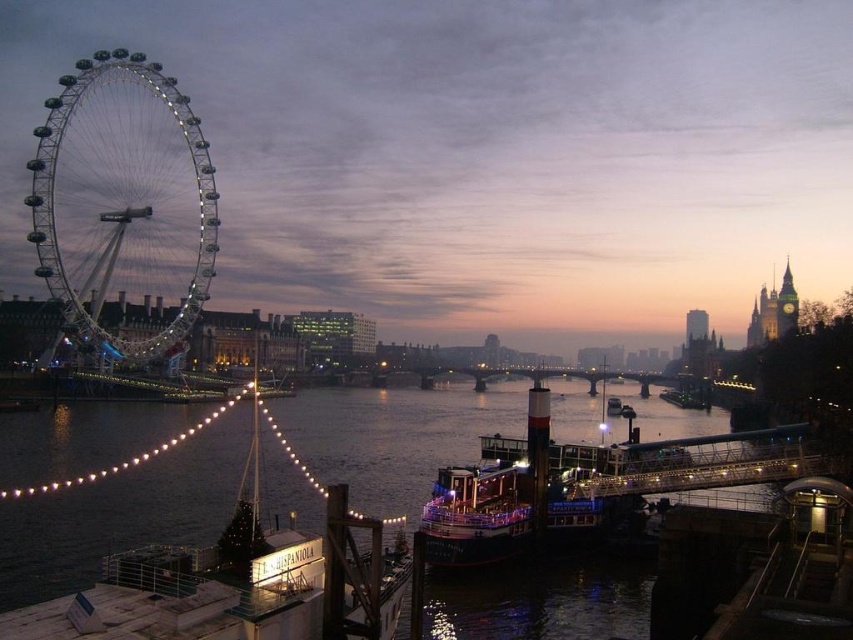
You are a photographer planning to take a photo of the shiny metallic ferris wheel at left and the shiny red boat at center. You want to ensure both are visible in the frame. Given their sizes, which object should you focus on to include both in the photo?

The shiny metallic ferris wheel at left is much taller than the shiny red boat at center, so you should focus on the ferris wheel to ensure both are visible in the photo.